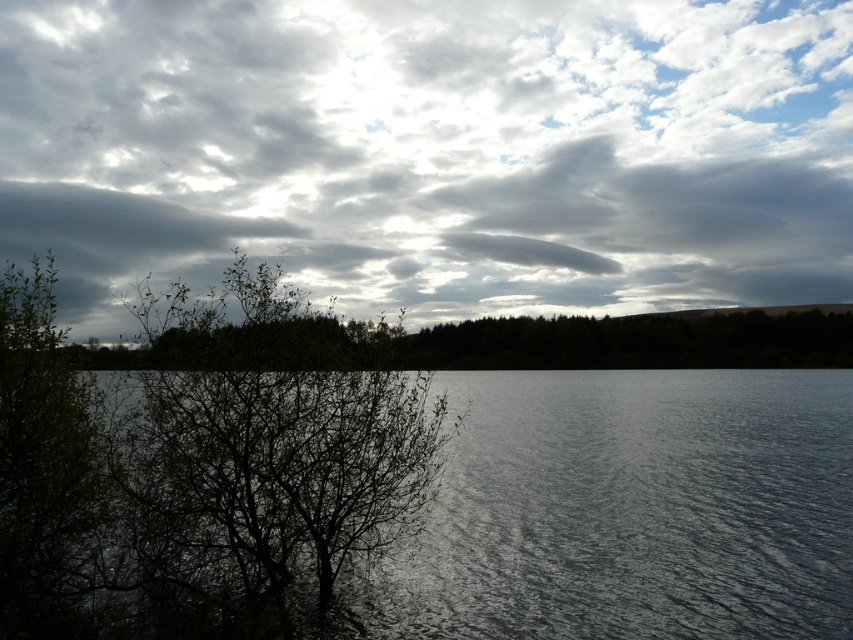
Between green leafy tree at center and green leafy tree at left, which one appears on the left side from the viewer's perspective?

green leafy tree at left is more to the left.

You are a GUI agent. You are given a task and a screenshot of the screen. Output one action in this format:
    pyautogui.click(x=<x>, y=<y>)
    Task: Click on the green leafy tree at center
    This screenshot has height=640, width=853.
    Given the screenshot: What is the action you would take?
    pyautogui.click(x=265, y=444)

Is green leafy tree at lower left taller than green leafy tree at left?

Yes.

Does point (119, 362) lie in front of point (68, 540)?

No.

Find the location of a particular element. green leafy tree at lower left is located at coordinates (508, 344).

Is point (817, 625) more distant than point (49, 364)?

Yes, point (817, 625) is farther from viewer.

Is glossy water at lower left wider than green leafy tree at left?

Indeed, glossy water at lower left has a greater width compared to green leafy tree at left.

Who is more forward, (x=624, y=380) or (x=3, y=490)?

Point (x=3, y=490) is in front.

At what (x,y) coordinates should I click in order to perform the action: click on glossy water at lower left. Please return your answer as a coordinate pair (x, y). This screenshot has height=640, width=853. Looking at the image, I should click on (635, 508).